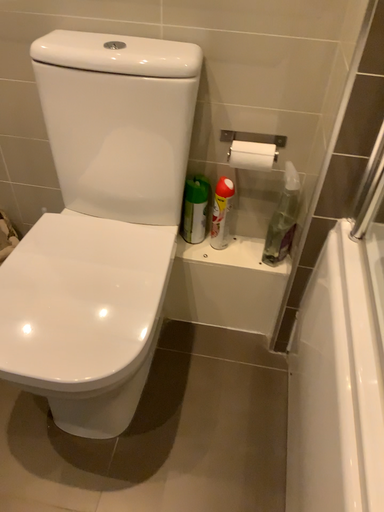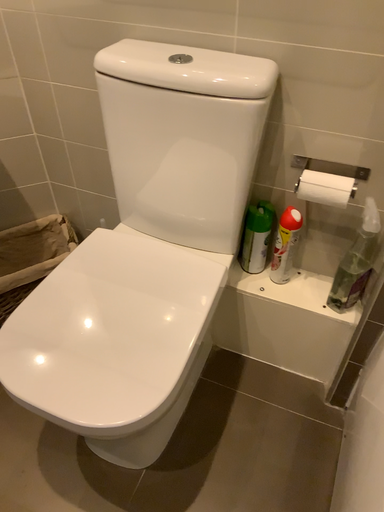
Question: Which way did the camera rotate in the video?

Choices:
 (A) rotated left
 (B) rotated right

Answer: (A)